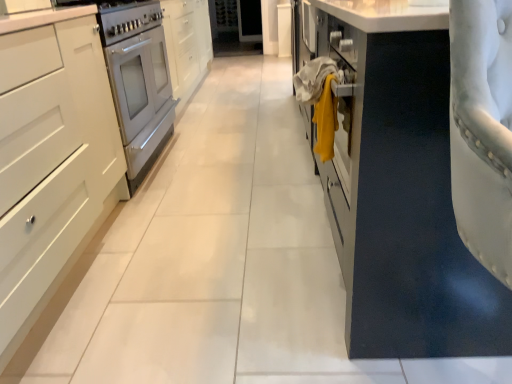
Question: Is yellow fabric at center beside white glossy oven at left?

Choices:
 (A) no
 (B) yes

Answer: (A)

Question: Is yellow fabric at center aimed at white glossy oven at left?

Choices:
 (A) no
 (B) yes

Answer: (A)

Question: Is yellow fabric at center far away from white glossy oven at left?

Choices:
 (A) no
 (B) yes

Answer: (B)

Question: Considering the relative positions of yellow fabric at center and white glossy oven at left in the image provided, is yellow fabric at center to the right of white glossy oven at left from the viewer's perspective?

Choices:
 (A) yes
 (B) no

Answer: (A)

Question: Can you confirm if yellow fabric at center is taller than white glossy oven at left?

Choices:
 (A) yes
 (B) no

Answer: (B)

Question: Is yellow fabric at center at the left side of white glossy oven at left?

Choices:
 (A) no
 (B) yes

Answer: (A)

Question: Is white matte cabinet at left, which is the 1th cabinetry in left-to-right order, completely or partially inside yellow fabric at center?

Choices:
 (A) yes
 (B) no

Answer: (B)

Question: Can you confirm if yellow fabric at center is thinner than white matte cabinet at left, which is the 1th cabinetry in left-to-right order?

Choices:
 (A) no
 (B) yes

Answer: (B)

Question: Considering the relative sizes of yellow fabric at center and white matte cabinet at left, which is the 1th cabinetry in left-to-right order, in the image provided, is yellow fabric at center bigger than white matte cabinet at left, which is the 1th cabinetry in left-to-right order,?

Choices:
 (A) no
 (B) yes

Answer: (A)

Question: Is the position of yellow fabric at center less distant than that of white matte cabinet at left, which is the 1th cabinetry in left-to-right order?

Choices:
 (A) no
 (B) yes

Answer: (A)

Question: Could you tell me if yellow fabric at center is turned towards white matte cabinet at left, which is the 1th cabinetry in left-to-right order?

Choices:
 (A) no
 (B) yes

Answer: (B)

Question: Is yellow fabric at center positioned behind white matte cabinet at left, the second cabinetry viewed from the right?

Choices:
 (A) no
 (B) yes

Answer: (B)

Question: Would you say white matte cabinet at left, the second cabinetry viewed from the right, is outside white glossy oven at left?

Choices:
 (A) no
 (B) yes

Answer: (B)